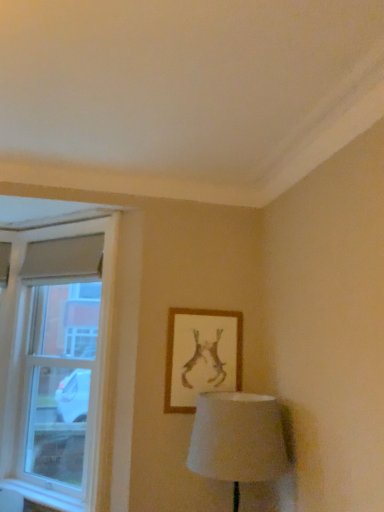
Question: Does wooden framed artwork at upper center have a smaller size compared to white glass window at left?

Choices:
 (A) yes
 (B) no

Answer: (A)

Question: Would you say white glass window at left is part of wooden framed artwork at upper center's contents?

Choices:
 (A) no
 (B) yes

Answer: (A)

Question: Is wooden framed artwork at upper center at the left side of white glass window at left?

Choices:
 (A) yes
 (B) no

Answer: (B)

Question: From a real-world perspective, is wooden framed artwork at upper center beneath white glass window at left?

Choices:
 (A) yes
 (B) no

Answer: (A)

Question: Does wooden framed artwork at upper center appear on the right side of white glass window at left?

Choices:
 (A) yes
 (B) no

Answer: (A)

Question: From a real-world perspective, is wooden framed artwork at upper center physically above white glass window at left?

Choices:
 (A) no
 (B) yes

Answer: (A)

Question: Considering the relative sizes of white plastic window sill at lower left and wooden framed artwork at upper center in the image provided, is white plastic window sill at lower left smaller than wooden framed artwork at upper center?

Choices:
 (A) no
 (B) yes

Answer: (B)

Question: From a real-world perspective, is white plastic window sill at lower left on top of wooden framed artwork at upper center?

Choices:
 (A) no
 (B) yes

Answer: (A)

Question: From a real-world perspective, is white plastic window sill at lower left under wooden framed artwork at upper center?

Choices:
 (A) yes
 (B) no

Answer: (A)

Question: Does white plastic window sill at lower left have a larger size compared to wooden framed artwork at upper center?

Choices:
 (A) yes
 (B) no

Answer: (B)

Question: Is white plastic window sill at lower left at the left side of wooden framed artwork at upper center?

Choices:
 (A) no
 (B) yes

Answer: (B)

Question: Is white plastic window sill at lower left wider than wooden framed artwork at upper center?

Choices:
 (A) yes
 (B) no

Answer: (A)

Question: Is white glass window at left positioned with its back to wooden framed artwork at upper center?

Choices:
 (A) no
 (B) yes

Answer: (A)